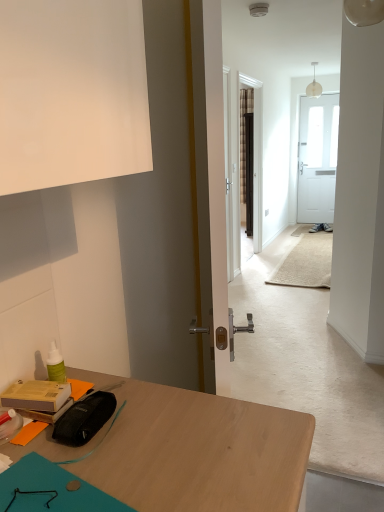
Question: From a real-world perspective, is matte cardboard box at lower left, acting as the 2th stationery starting from the right, physically above translucent glass pendant light at upper center?

Choices:
 (A) yes
 (B) no

Answer: (B)

Question: Does matte cardboard box at lower left, the first stationery when ordered from left to right, have a lesser width compared to translucent glass pendant light at upper center?

Choices:
 (A) no
 (B) yes

Answer: (B)

Question: Is matte cardboard box at lower left, acting as the 2th stationery starting from the right, positioned far away from translucent glass pendant light at upper center?

Choices:
 (A) no
 (B) yes

Answer: (B)

Question: Is matte cardboard box at lower left, the first stationery when ordered from left to right, positioned with its back to translucent glass pendant light at upper center?

Choices:
 (A) no
 (B) yes

Answer: (A)

Question: Is matte cardboard box at lower left, acting as the 2th stationery starting from the right, taller than translucent glass pendant light at upper center?

Choices:
 (A) yes
 (B) no

Answer: (B)

Question: Do you think translucent glass pendant light at upper center is within matte cardboard box at lower left, acting as the 2th stationery starting from the right, or outside of it?

Choices:
 (A) outside
 (B) inside

Answer: (A)

Question: From the image's perspective, is translucent glass pendant light at upper center above or below matte cardboard box at lower left, the first stationery when ordered from left to right?

Choices:
 (A) below
 (B) above

Answer: (B)

Question: Looking at their shapes, would you say translucent glass pendant light at upper center is wider or thinner than matte cardboard box at lower left, the first stationery when ordered from left to right?

Choices:
 (A) thin
 (B) wide

Answer: (B)

Question: In terms of size, does translucent glass pendant light at upper center appear bigger or smaller than matte cardboard box at lower left, the first stationery when ordered from left to right?

Choices:
 (A) small
 (B) big

Answer: (B)

Question: Looking at their shapes, would you say matte cardboard box at lower left, the first stationery when ordered from left to right, is wider or thinner than translucent glass pendant light at upper center?

Choices:
 (A) wide
 (B) thin

Answer: (B)

Question: From a real-world perspective, is matte cardboard box at lower left, the first stationery when ordered from left to right, positioned above or below translucent glass pendant light at upper center?

Choices:
 (A) above
 (B) below

Answer: (B)

Question: Is matte cardboard box at lower left, acting as the 2th stationery starting from the right, to the left or to the right of translucent glass pendant light at upper center in the image?

Choices:
 (A) left
 (B) right

Answer: (A)

Question: In the image, is matte cardboard box at lower left, acting as the 2th stationery starting from the right, positioned in front of or behind translucent glass pendant light at upper center?

Choices:
 (A) behind
 (B) front

Answer: (B)

Question: In terms of width, does matte black pouch at lower left, the 2th stationery when ordered from left to right, look wider or thinner when compared to matte cardboard box at lower left, acting as the 2th stationery starting from the right?

Choices:
 (A) thin
 (B) wide

Answer: (A)

Question: From the image's perspective, relative to matte cardboard box at lower left, acting as the 2th stationery starting from the right, is matte black pouch at lower left, the 2th stationery when ordered from left to right, above or below?

Choices:
 (A) above
 (B) below

Answer: (B)